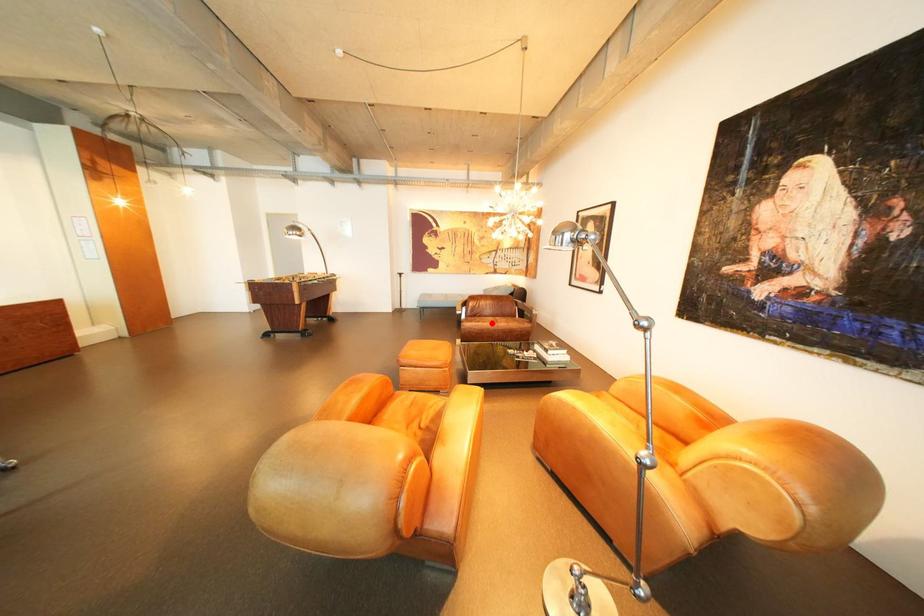
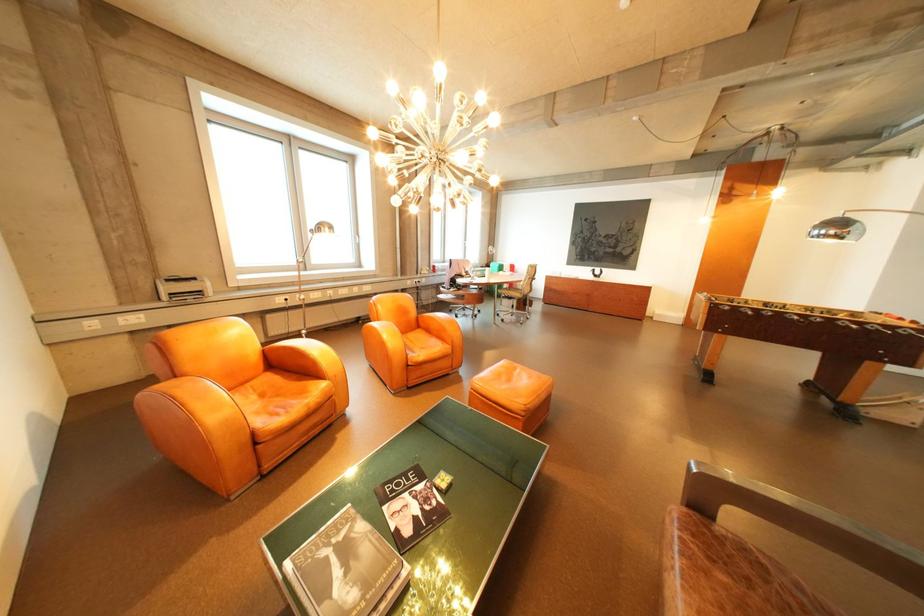
In the second image, find the point that corresponds to the highlighted location in the first image.

(696, 554)